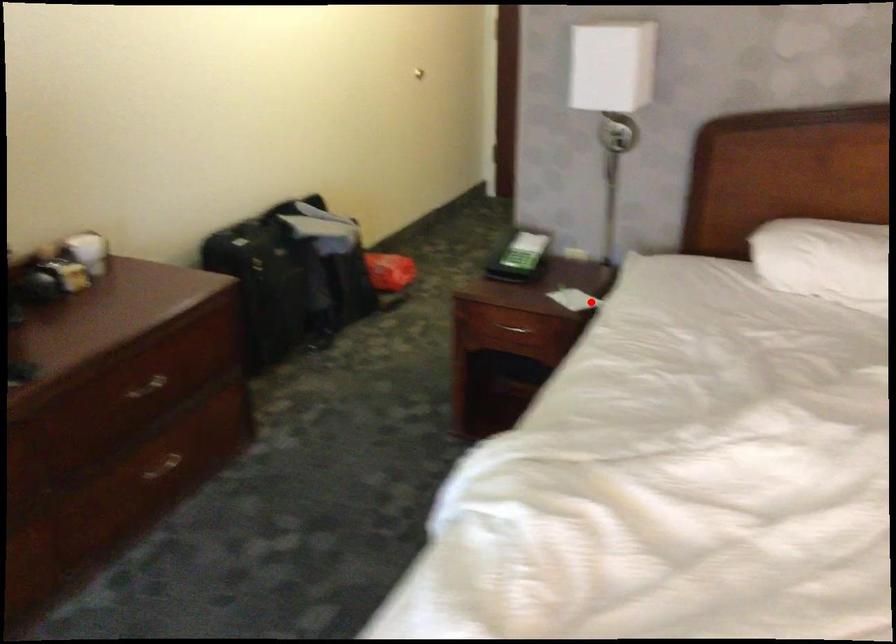
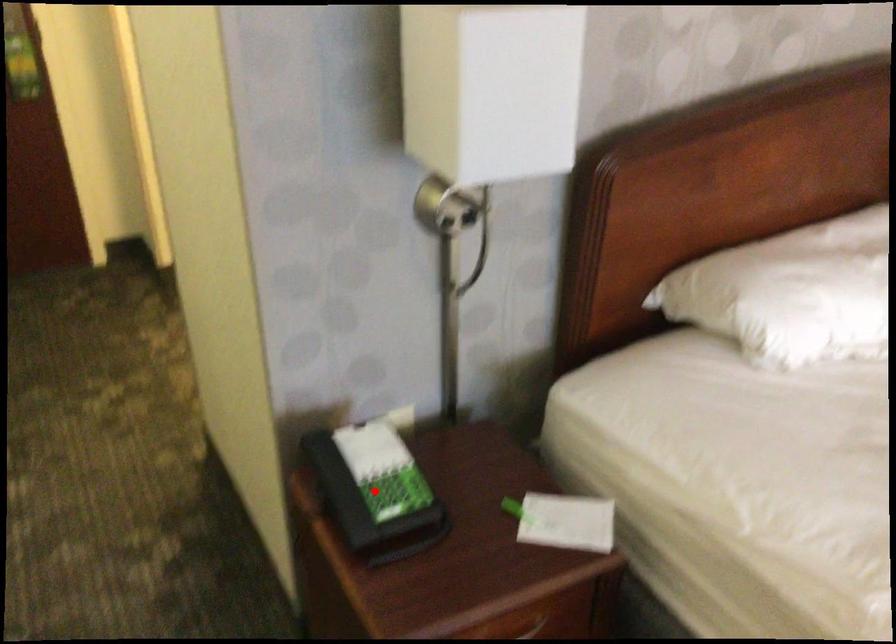
I am providing you with two images of the same scene from different viewpoints. A red point is marked on the first image and another point is marked on the second image. Does the point marked in image1 correspond to the same location as the one in image2?

No